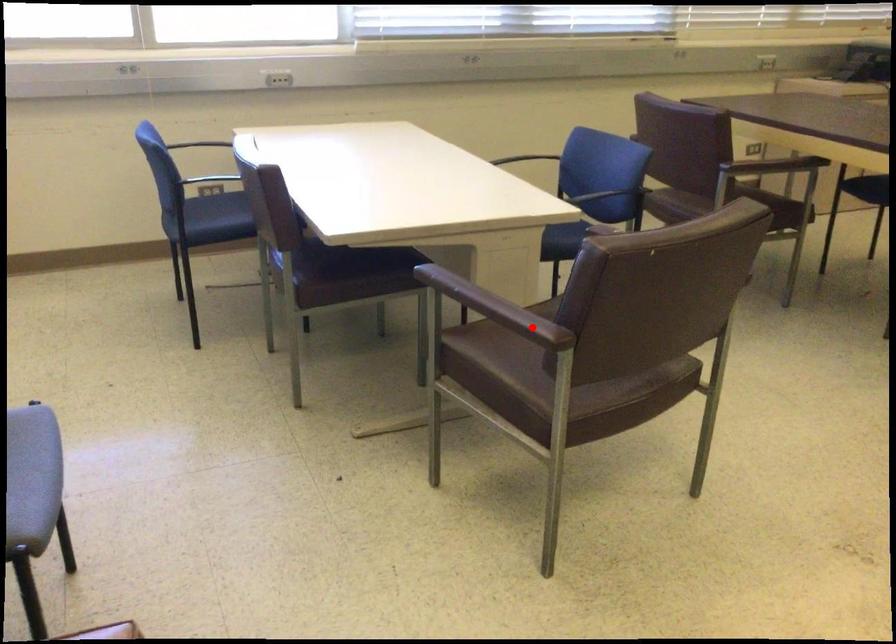
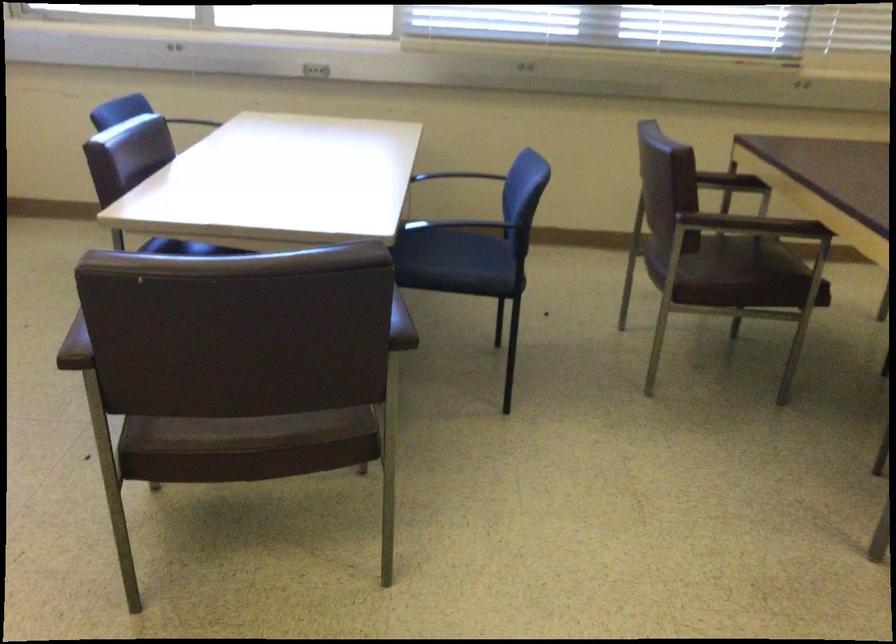
Find the pixel in the second image that matches the highlighted location in the first image.

(75, 346)